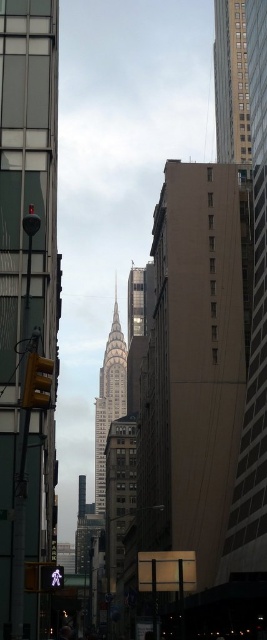
Based on the photo, which is above, reflective glass skyscraper at upper right or gray stone tower at center?

reflective glass skyscraper at upper right is higher up.

Who is taller, reflective glass skyscraper at upper right or gray stone tower at center?

With more height is gray stone tower at center.

Is point (245, 32) less distant than point (111, 353)?

Yes, it is in front of point (111, 353).

The width and height of the screenshot is (267, 640). In order to click on reflective glass skyscraper at upper right in this screenshot , I will do `click(230, 83)`.

Does matte glass skyscraper at center have a lesser height compared to gray stone tower at center?

Yes.

Looking at this image, is matte glass skyscraper at center wider than gray stone tower at center?

In fact, matte glass skyscraper at center might be narrower than gray stone tower at center.

Who is more distant from viewer, (x=48, y=348) or (x=118, y=403)?

Positioned behind is point (x=118, y=403).

I want to click on matte glass skyscraper at center, so click(26, 300).

Describe the element at coordinates (26, 300) in the screenshot. I see `matte glass skyscraper at center` at that location.

Who is positioned more to the right, matte glass skyscraper at center or reflective glass skyscraper at upper right?

From the viewer's perspective, reflective glass skyscraper at upper right appears more on the right side.

Find the location of a particular element. The image size is (267, 640). matte glass skyscraper at center is located at coordinates (26, 300).